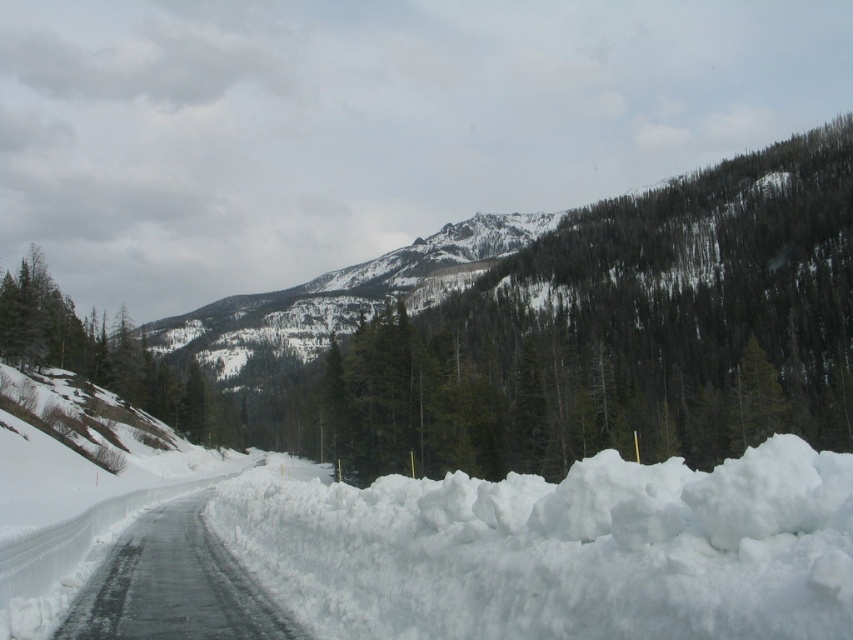
You are standing at the point marked as point [560,548] in the snowy mountain road scene. What is the terrain like at this location?

The terrain at point [560,548] is white fluffy snow at center.

You are driving a car and you see the white fluffy snow at center and the icy asphalt road at center ahead. Which one is higher in position?

The white fluffy snow at center is above the icy asphalt road at center.